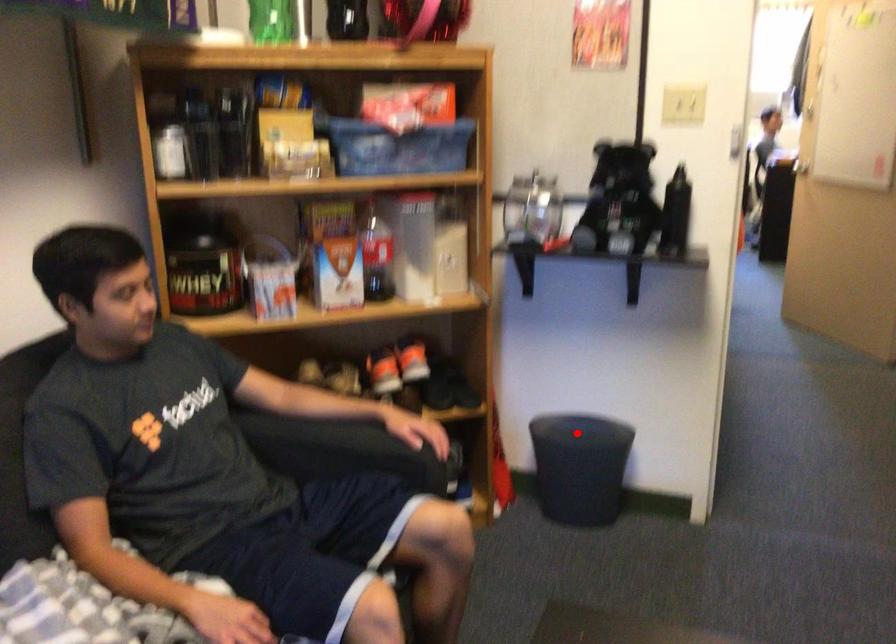
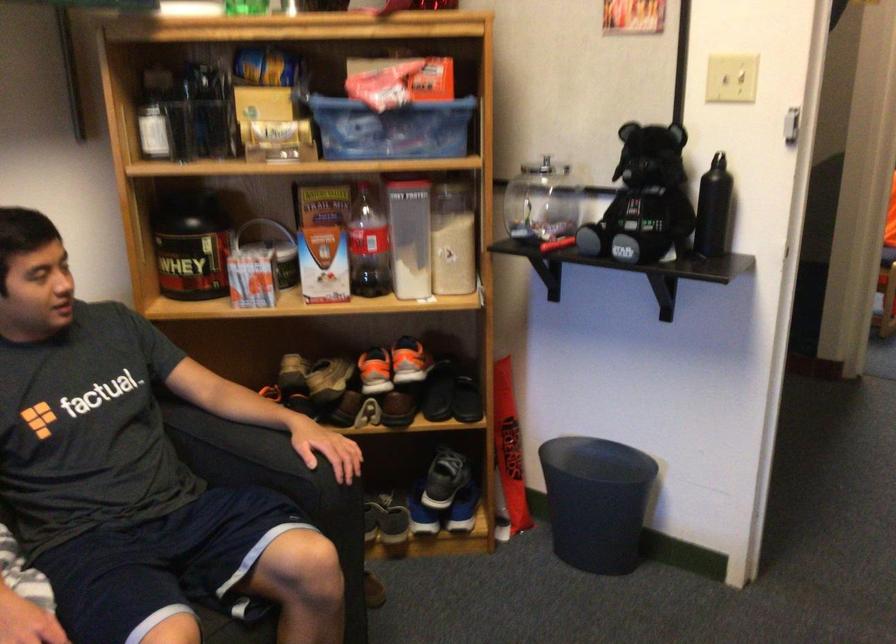
Question: I am providing you with two images of the same scene from different viewpoints. In image1, a red point is highlighted. Considering the same 3D point in image2, which of the following is correct?

Choices:
 (A) It is closer
 (B) It is farther

Answer: (A)